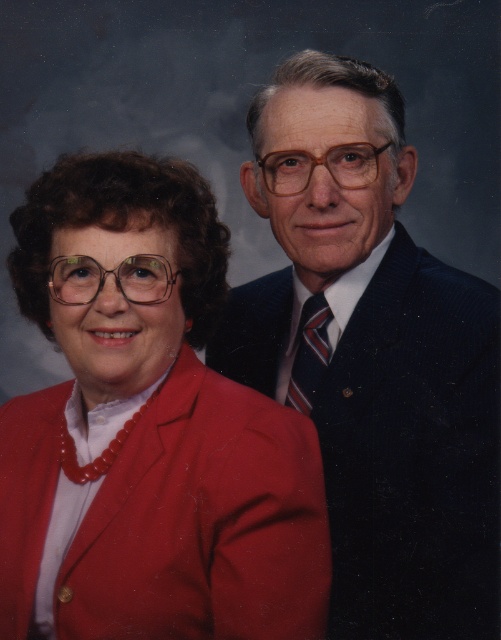
You are an interior designer assessing the color coordination of a room. You observe the matte red blazer at left and the dark blue suit at center in the scene. Which object takes up more visual space in the image?

The dark blue suit at center occupies more visual space than the matte red blazer at left, as stated in the description.

You are a photographer adjusting the lighting in the studio. You have two lights to position at specific coordinates. The first light must be placed at point (227,564), and the second at point (304,323). Which light should you adjust first if you want to ensure the light closer to the camera is set up before the other?

You should adjust the light at point (227,564) first because it is in front of point (304,323), making it closer to the camera.

You are a photographer setting up a lighting setup for a portrait. You have a spotlight that can only illuminate objects on the left side of the dark blue suit at center. Will the matte red blazer at left be illuminated by this spotlight?

The matte red blazer at left is positioned on the left side of the dark blue suit at center, so yes, the spotlight will illuminate the matte red blazer at left since it is on the left side of the dark blue suit at center.